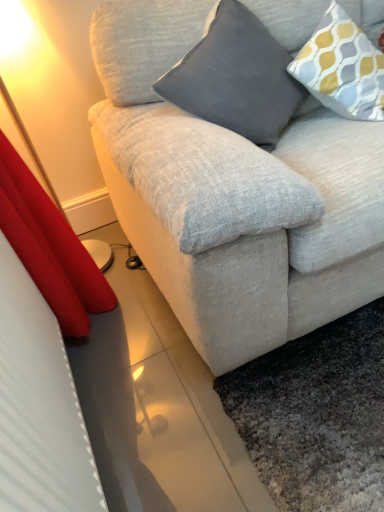
Question: Based on their positions, is patterned fabric pillow at upper right, the 2th pillow positioned from the left, located to the left or right of gray fabric pillow at upper center, positioned as the 1th pillow in left-to-right order?

Choices:
 (A) right
 (B) left

Answer: (A)

Question: Is point (347, 88) positioned closer to the camera than point (236, 10)?

Choices:
 (A) farther
 (B) closer

Answer: (A)

Question: Considering their positions, is patterned fabric pillow at upper right, the 1th pillow positioned from the right, located in front of or behind gray fabric pillow at upper center, which is the 2th pillow in right-to-left order?

Choices:
 (A) front
 (B) behind

Answer: (B)

Question: Is gray fabric pillow at upper center, which is the 2th pillow in right-to-left order, wider or thinner than patterned fabric pillow at upper right, the 1th pillow positioned from the right?

Choices:
 (A) wide
 (B) thin

Answer: (A)

Question: Would you say gray fabric pillow at upper center, positioned as the 1th pillow in left-to-right order, is inside or outside patterned fabric pillow at upper right, the 1th pillow positioned from the right?

Choices:
 (A) inside
 (B) outside

Answer: (B)

Question: Is gray fabric pillow at upper center, positioned as the 1th pillow in left-to-right order, taller or shorter than patterned fabric pillow at upper right, the 1th pillow positioned from the right?

Choices:
 (A) short
 (B) tall

Answer: (B)

Question: Looking at the image, does gray fabric pillow at upper center, positioned as the 1th pillow in left-to-right order, seem bigger or smaller compared to patterned fabric pillow at upper right, the 2th pillow positioned from the left?

Choices:
 (A) big
 (B) small

Answer: (A)